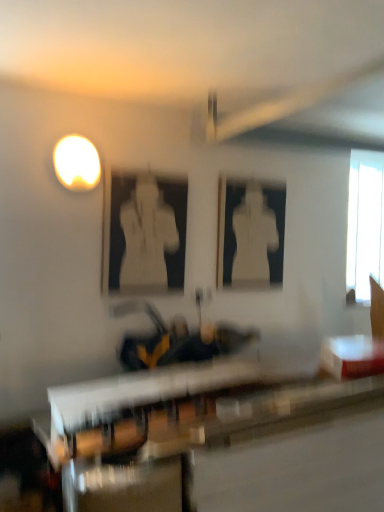
Question: Can you confirm if white glossy statue at center, which is the 2th person from back to front, is bigger than matte white light at upper left?

Choices:
 (A) yes
 (B) no

Answer: (A)

Question: Is the position of white glossy statue at center, which is counted as the second person, starting from the right, more distant than that of matte white light at upper left?

Choices:
 (A) no
 (B) yes

Answer: (B)

Question: Is white glossy statue at center, which is counted as the second person, starting from the right, to the right of matte white light at upper left from the viewer's perspective?

Choices:
 (A) yes
 (B) no

Answer: (A)

Question: From the image's perspective, does white glossy statue at center, which is counted as the second person, starting from the right, appear lower than matte white light at upper left?

Choices:
 (A) no
 (B) yes

Answer: (B)

Question: Considering the relative sizes of white glossy statue at center, which is the first person from front to back, and matte white light at upper left in the image provided, is white glossy statue at center, which is the first person from front to back, shorter than matte white light at upper left?

Choices:
 (A) no
 (B) yes

Answer: (A)

Question: From the image's perspective, is white glossy statue at center, which is the first person from front to back, located above or below white glossy table at lower right, arranged as the second table when ordered from the bottom?

Choices:
 (A) below
 (B) above

Answer: (B)

Question: Is white glossy statue at center, acting as the 1th person starting from the left, taller or shorter than white glossy table at lower right, which is the 1th table in top-to-bottom order?

Choices:
 (A) short
 (B) tall

Answer: (B)

Question: Based on their positions, is white glossy statue at center, acting as the 1th person starting from the left, located to the left or right of white glossy table at lower right, which is the 1th table in top-to-bottom order?

Choices:
 (A) right
 (B) left

Answer: (B)

Question: Does point (147, 212) appear closer or farther from the camera than point (382, 347)?

Choices:
 (A) farther
 (B) closer

Answer: (B)

Question: Considering the positions of point click(81, 139) and point click(150, 244), is point click(81, 139) closer or farther from the camera than point click(150, 244)?

Choices:
 (A) closer
 (B) farther

Answer: (A)

Question: Is matte white light at upper left spatially inside white glossy statue at center, which is the 2th person from back to front, or outside of it?

Choices:
 (A) inside
 (B) outside

Answer: (B)

Question: From their relative heights in the image, would you say matte white light at upper left is taller or shorter than white glossy statue at center, which is the 2th person from back to front?

Choices:
 (A) short
 (B) tall

Answer: (A)

Question: Is matte white light at upper left bigger or smaller than white glossy statue at center, which is counted as the second person, starting from the right?

Choices:
 (A) big
 (B) small

Answer: (B)

Question: Considering the positions of point (370, 206) and point (342, 354), is point (370, 206) closer or farther from the camera than point (342, 354)?

Choices:
 (A) farther
 (B) closer

Answer: (A)

Question: In terms of width, does transparent glass window at upper right look wider or thinner when compared to white glossy table at lower right, which is the 1th table in top-to-bottom order?

Choices:
 (A) wide
 (B) thin

Answer: (B)